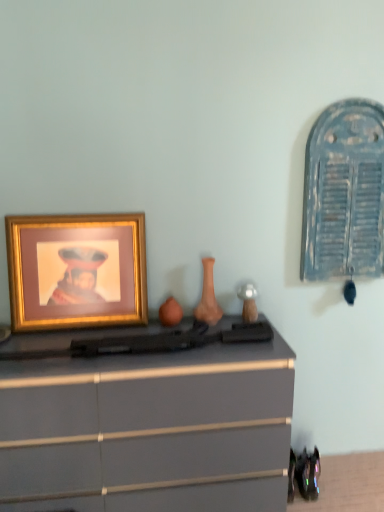
Question: Is matte orange vase at center smaller than matte gray chest of drawers at center?

Choices:
 (A) no
 (B) yes

Answer: (B)

Question: Considering the relative sizes of matte orange vase at center and matte gray chest of drawers at center in the image provided, is matte orange vase at center bigger than matte gray chest of drawers at center?

Choices:
 (A) yes
 (B) no

Answer: (B)

Question: Is matte orange vase at center surrounding matte gray chest of drawers at center?

Choices:
 (A) no
 (B) yes

Answer: (A)

Question: Is matte orange vase at center looking in the opposite direction of matte gray chest of drawers at center?

Choices:
 (A) yes
 (B) no

Answer: (B)

Question: Would you consider matte orange vase at center to be distant from matte gray chest of drawers at center?

Choices:
 (A) no
 (B) yes

Answer: (A)

Question: Is matte orange vase at center taller than matte gray chest of drawers at center?

Choices:
 (A) yes
 (B) no

Answer: (B)

Question: Considering the relative sizes of matte gray chest of drawers at center and gold metallic picture frame at left in the image provided, is matte gray chest of drawers at center smaller than gold metallic picture frame at left?

Choices:
 (A) yes
 (B) no

Answer: (B)

Question: Can we say matte gray chest of drawers at center lies outside gold metallic picture frame at left?

Choices:
 (A) no
 (B) yes

Answer: (B)

Question: Does matte gray chest of drawers at center have a greater height compared to gold metallic picture frame at left?

Choices:
 (A) yes
 (B) no

Answer: (A)

Question: From the image's perspective, is matte gray chest of drawers at center on top of gold metallic picture frame at left?

Choices:
 (A) yes
 (B) no

Answer: (B)

Question: Is matte gray chest of drawers at center closer to camera compared to gold metallic picture frame at left?

Choices:
 (A) yes
 (B) no

Answer: (A)

Question: Is matte gray chest of drawers at center bigger than gold metallic picture frame at left?

Choices:
 (A) yes
 (B) no

Answer: (A)

Question: Considering the relative sizes of gold metallic picture frame at left and matte orange vase at center in the image provided, is gold metallic picture frame at left shorter than matte orange vase at center?

Choices:
 (A) yes
 (B) no

Answer: (B)